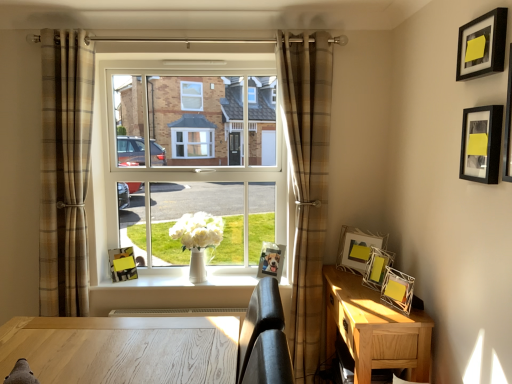
Question: Relative to light brown wood nightstand at lower right, is black matte picture frame at upper right, which is the 1th picture frame in right-to-left order, in front or behind?

Choices:
 (A) front
 (B) behind

Answer: (A)

Question: Is black matte picture frame at upper right, which is the 1th picture frame in right-to-left order, bigger or smaller than light brown wood nightstand at lower right?

Choices:
 (A) big
 (B) small

Answer: (B)

Question: Which is farther from the black matte picture frame at upper right, which is the 2th picture frame in right-to-left order?

Choices:
 (A) light brown wood nightstand at lower right
 (B) black matte picture frame at upper right, which is the fifth picture frame in back-to-front order
 (C) metallic silver picture frame at right, the third picture frame from the front
 (D) matte yellow picture frame at center, the 6th picture frame when ordered from front to back
 (E) brown plaid curtain at center, the 1th curtain viewed from the right

Answer: (D)

Question: Which of these objects is positioned farthest from the white glossy vase at center?

Choices:
 (A) matte yellow picture frame at center, the 1th picture frame in the back-to-front sequence
 (B) metallic silver photo frame at center, placed as the second picture frame when sorted from left to right
 (C) light brown wood nightstand at lower right
 (D) black matte picture frame at upper right, which is the fifth picture frame in back-to-front order
 (E) white wire picture frame at right, the 3th picture frame viewed from the left

Answer: (D)